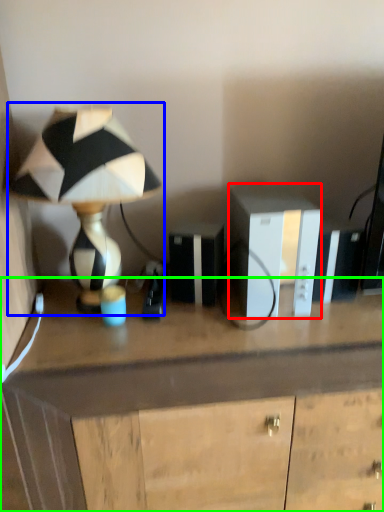
Question: Which object is positioned farthest from cabinetry (highlighted by a red box)? Select from lamp (highlighted by a blue box) and desk (highlighted by a green box).

Choices:
 (A) lamp
 (B) desk

Answer: (A)